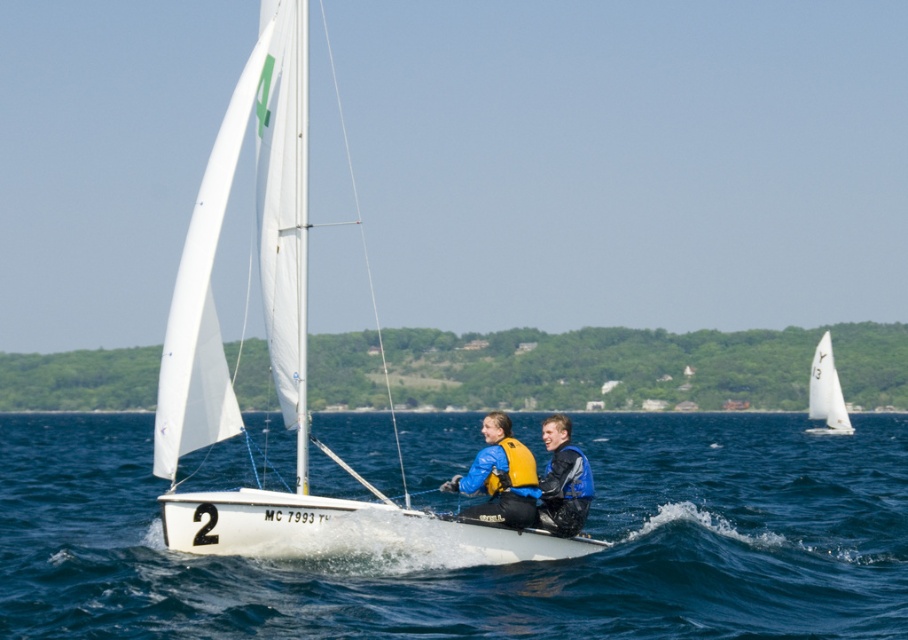
You are a sailor on the white sailboat with the green logo near its top left corner. You need to adjust the sail to the point marked at coordinates (826,392). Where is this point located relative to the sail?

The point at coordinates (826,392) marks the white sail at upper right, so you should adjust the sail towards its upper right corner.